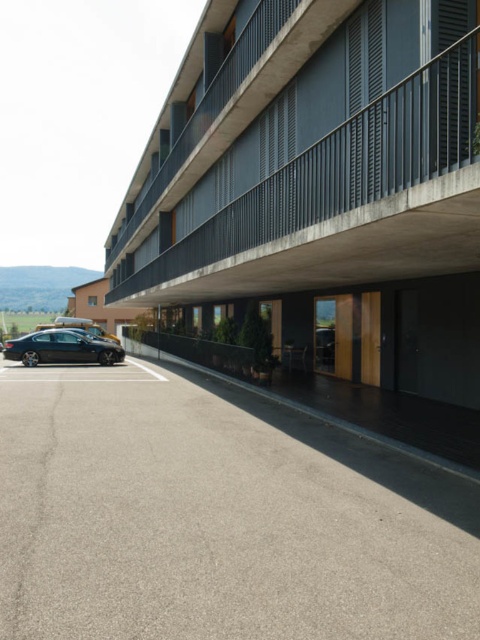
You are standing in front of the matte black building at center. You want to take a photo of it with your smartphone. The recommended distance for clear photos is at least 5 meters. Can you take a clear photo from your current position?

The matte black building at center is 5.26 meters away from camera, which meets the recommended distance of at least 5 meters. Therefore, you can take a clear photo from your current position.

You are standing in front of the building and want to park your car in the gray asphalt parking lot at lower left. The shiny black sedan at lower left is currently blocking the entrance. Can you drive around it to access the parking lot?

The gray asphalt parking lot at lower left is not as tall as the shiny black sedan at lower left, so the sedan is blocking the entrance. You can drive around it on either side to access the parking lot since the parking lot is shorter than the sedan.

You are standing in front of the matte black building at center and want to take a photo of it. Since the gray asphalt parking lot at lower left is in the foreground, will the building appear larger or smaller in the photo compared to the parking lot?

The matte black building at center has a greater height compared to the gray asphalt parking lot at lower left, so the building will appear larger in the photo than the parking lot.